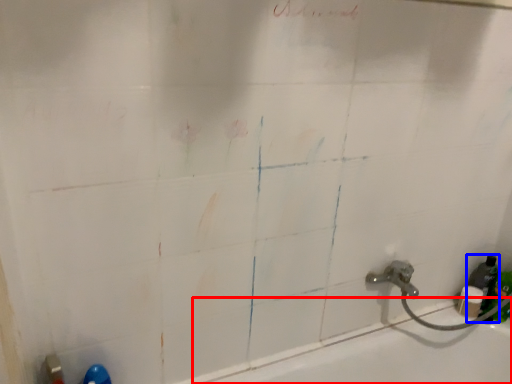
Question: Which point is closer to the camera, bath (highlighted by a red box) or bottle (highlighted by a blue box)?

Choices:
 (A) bath
 (B) bottle

Answer: (A)